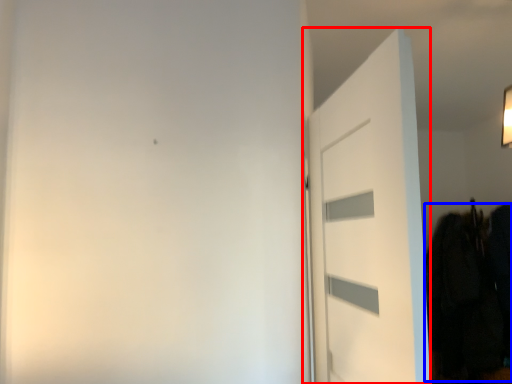
Question: Which point is closer to the camera, door (highlighted by a red box) or clothing (highlighted by a blue box)?

Choices:
 (A) door
 (B) clothing

Answer: (A)